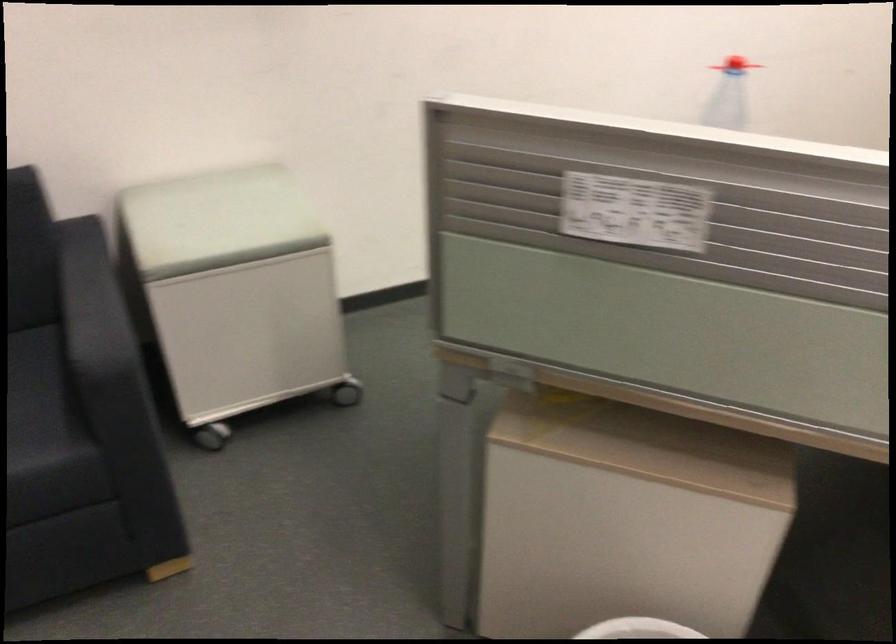
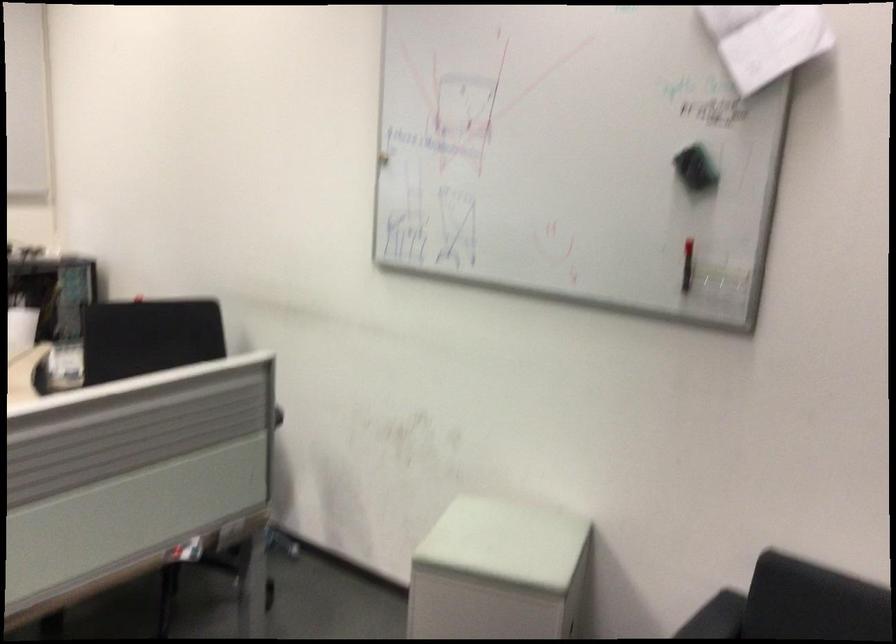
The first image is from the beginning of the video and the second image is from the end. How did the camera likely rotate when shooting the video?

The rotation direction of the camera is right-down.